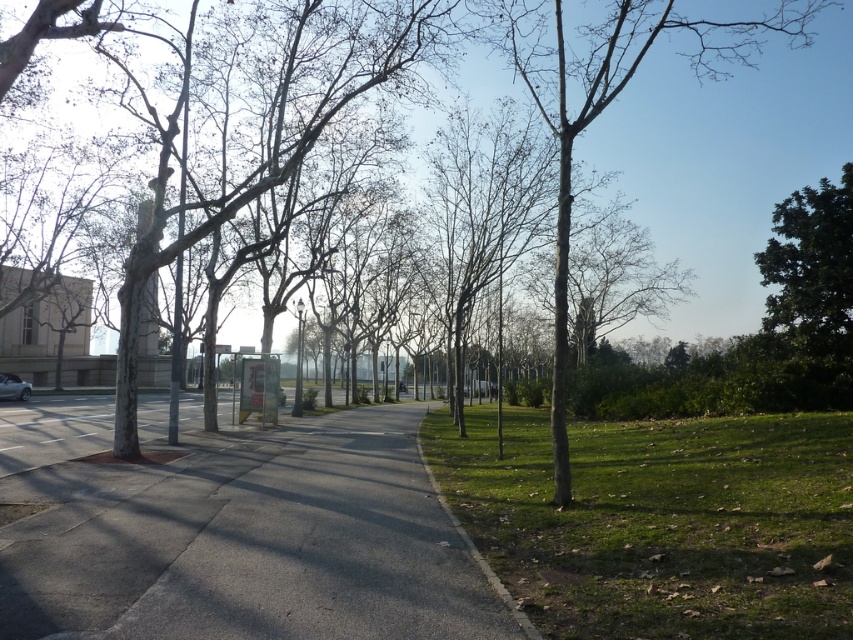
Based on the scene description, where is the smooth bark tree at center located in the image?

The smooth bark tree at center is located at point (614, 96).

You are standing at the bus stop on the left side of the park and want to walk to the center of the image. According to the coordinates provided, where will you find the gray concrete pavement at center?

The gray concrete pavement at center is located at coordinates point (230, 531).